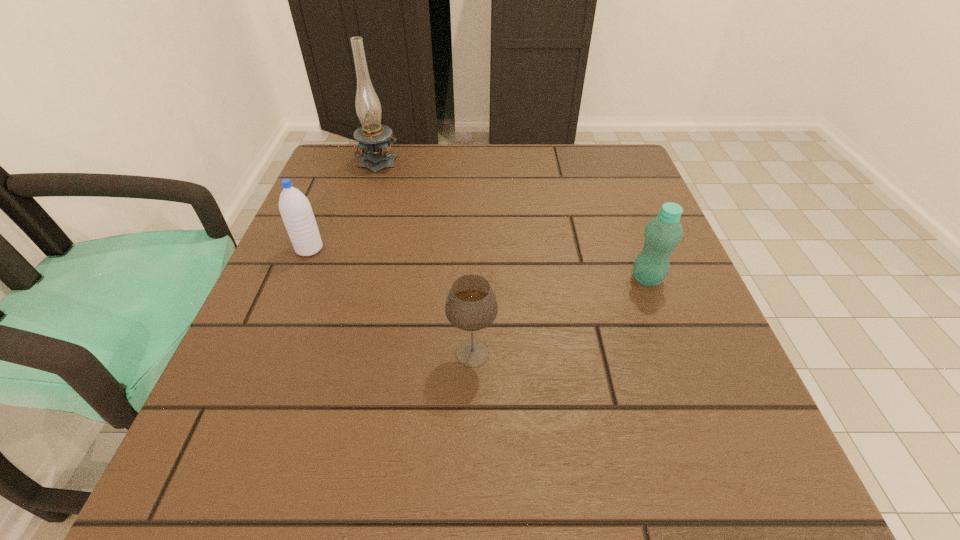
In the image, there is a desktop. What are the coordinates of `free space at the near edge` in the screenshot? It's located at (461, 505).

In order to click on vacant region at the left edge of the desktop in this screenshot , I will do `click(255, 328)`.

The width and height of the screenshot is (960, 540). What are the coordinates of `free location at the right edge` in the screenshot? It's located at (636, 364).

Identify the location of free space at the far left corner of the desktop. The height and width of the screenshot is (540, 960). (372, 189).

This screenshot has width=960, height=540. What are the coordinates of `vacant space at the far right corner of the desktop` in the screenshot? It's located at (638, 176).

In the image, there is a desktop. Where is `vacant space at the near right corner`? vacant space at the near right corner is located at coordinates (773, 494).

Image resolution: width=960 pixels, height=540 pixels. I want to click on vacant space that is in between the farther water bottle and the nearer water bottle, so click(x=478, y=264).

Locate an element on the screen. Image resolution: width=960 pixels, height=540 pixels. free space between the leftmost object and the farthest object is located at coordinates (345, 204).

Where is `vacant point located between the third object from left to right and the second farthest object`? vacant point located between the third object from left to right and the second farthest object is located at coordinates (391, 301).

You are a GUI agent. You are given a task and a screenshot of the screen. Output one action in this format:
    pyautogui.click(x=<x>, y=<y>)
    Task: Click on the free space between the nearer water bottle and the second object from right to left
    This screenshot has height=540, width=960.
    Given the screenshot: What is the action you would take?
    pyautogui.click(x=560, y=316)